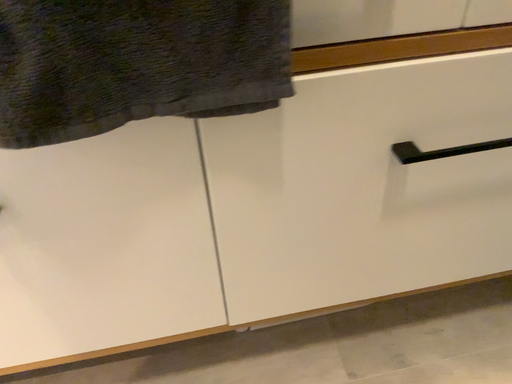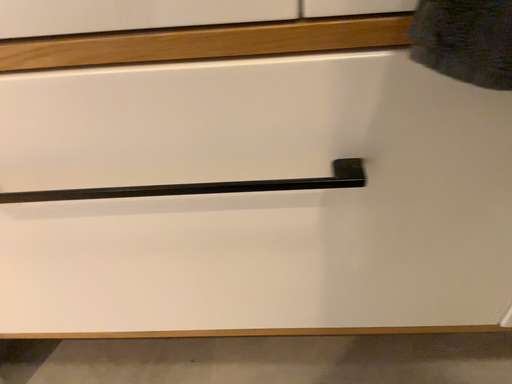
Question: Which way did the camera rotate in the video?

Choices:
 (A) rotated left
 (B) rotated right

Answer: (A)